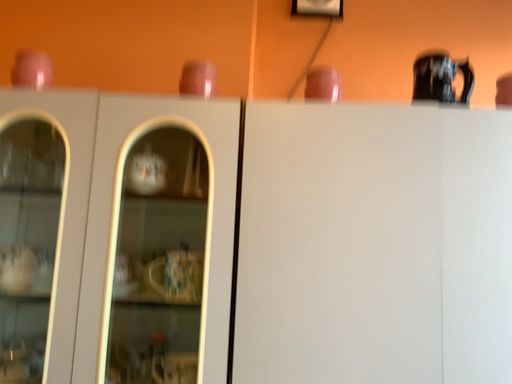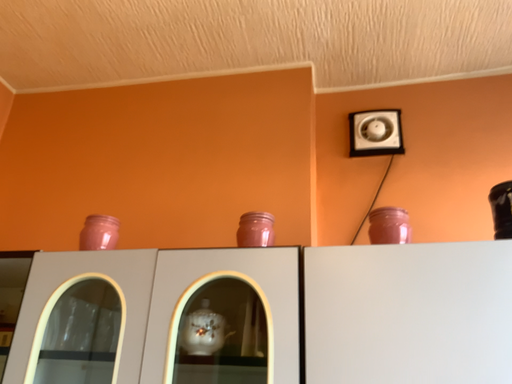
Question: Which way did the camera rotate in the video?

Choices:
 (A) rotated downward
 (B) rotated upward

Answer: (B)